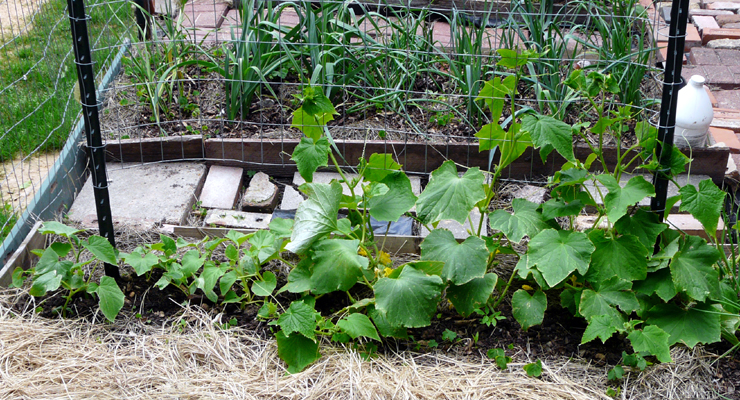
In order to click on bottle in this screenshot , I will do `click(684, 113)`.